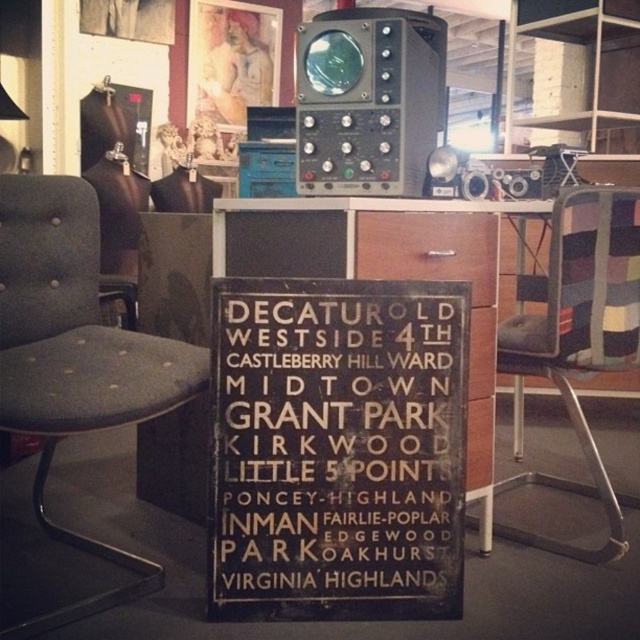
The width and height of the screenshot is (640, 640). Identify the location of dark gray fabric swivel chair at left. (74, 356).

Is the position of dark gray fabric swivel chair at left more distant than that of striped fabric swivel chair at right?

No.

Does point (42, 502) come closer to viewer compared to point (564, 310)?

No, it is behind (564, 310).

At what (x,y) coordinates should I click in order to perform the action: click on dark gray fabric swivel chair at left. Please return your answer as a coordinate pair (x, y). Looking at the image, I should click on click(74, 356).

Which of these two, brown wood sign at center or striped fabric swivel chair at right, stands taller?

With more height is striped fabric swivel chair at right.

Does point (410, 586) come in front of point (616, 307)?

Yes, point (410, 586) is in front of point (616, 307).

This screenshot has width=640, height=640. What do you see at coordinates (337, 449) in the screenshot?
I see `brown wood sign at center` at bounding box center [337, 449].

Locate an element on the screen. The height and width of the screenshot is (640, 640). brown wood sign at center is located at coordinates (337, 449).

Which of these two, brown wood sign at center or dark gray fabric swivel chair at left, stands taller?

With more height is brown wood sign at center.

Who is positioned more to the left, brown wood sign at center or dark gray fabric swivel chair at left?

Positioned to the left is dark gray fabric swivel chair at left.

The height and width of the screenshot is (640, 640). What do you see at coordinates (337, 449) in the screenshot?
I see `brown wood sign at center` at bounding box center [337, 449].

You are a GUI agent. You are given a task and a screenshot of the screen. Output one action in this format:
    pyautogui.click(x=<x>, y=<y>)
    Task: Click on the brown wood sign at center
    This screenshot has width=640, height=640.
    Given the screenshot: What is the action you would take?
    pyautogui.click(x=337, y=449)